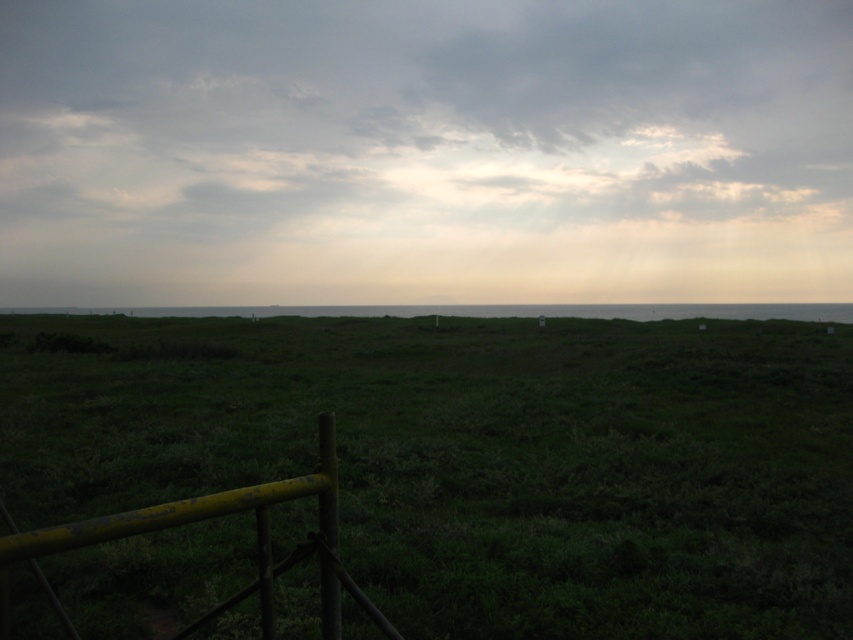
Question: Which of the following is the closest to the observer?

Choices:
 (A) (318, 548)
 (B) (94, 308)

Answer: (A)

Question: Which point appears farthest from the camera in this image?

Choices:
 (A) (138, 456)
 (B) (309, 534)

Answer: (A)

Question: Considering the real-world distances, which object is farthest from the green grass at center?

Choices:
 (A) cloudy sky at upper center
 (B) yellow painted wood fence at lower left
 (C) green grassy at center

Answer: (B)

Question: Does cloudy sky at upper center appear under yellow painted wood fence at lower left?

Choices:
 (A) no
 (B) yes

Answer: (A)

Question: Is green grassy at center to the left of yellow painted wood fence at lower left from the viewer's perspective?

Choices:
 (A) no
 (B) yes

Answer: (A)

Question: From the image, what is the correct spatial relationship of cloudy sky at upper center in relation to yellow painted wood fence at lower left?

Choices:
 (A) right
 (B) left

Answer: (B)